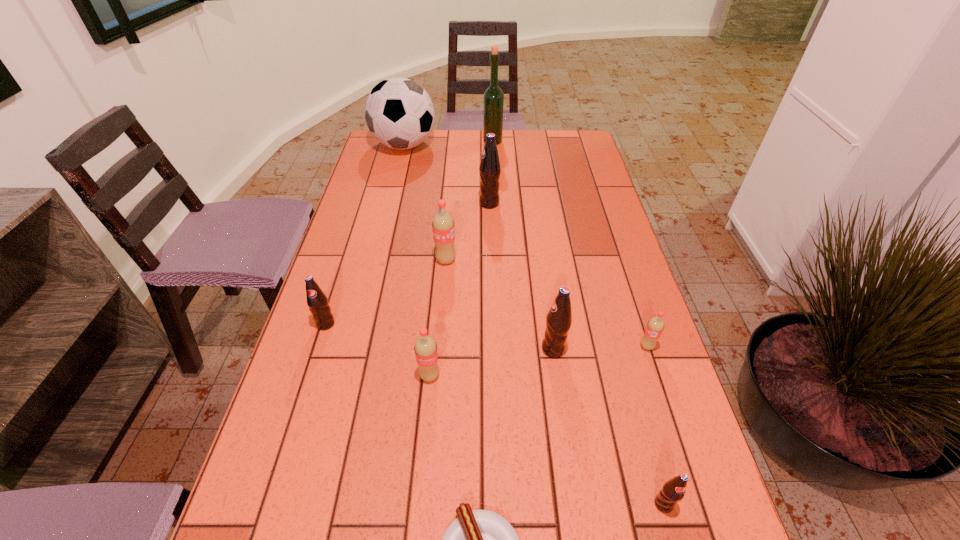
Find the location of `the second farthest black pop`. the second farthest black pop is located at coordinates (317, 301).

Locate an element on the screen. This screenshot has width=960, height=540. the nearest red soda is located at coordinates (426, 352).

Where is `the second nearest pop`? the second nearest pop is located at coordinates (426, 352).

You are a GUI agent. You are given a task and a screenshot of the screen. Output one action in this format:
    pyautogui.click(x=<x>, y=<y>)
    Task: Click on the rightmost object
    
    Given the screenshot: What is the action you would take?
    pyautogui.click(x=655, y=326)

Where is `the second farthest red soda`? This screenshot has height=540, width=960. the second farthest red soda is located at coordinates (655, 326).

At what (x,y) coordinates should I click in order to perform the action: click on the rightmost black pop. Please return your answer as a coordinate pair (x, y). This screenshot has width=960, height=540. Looking at the image, I should click on (673, 491).

At what (x,y) coordinates should I click in order to perform the action: click on the nearest black pop. Please return your answer as a coordinate pair (x, y). The height and width of the screenshot is (540, 960). Looking at the image, I should click on (673, 491).

This screenshot has height=540, width=960. Find the location of `free region located on the left of the liquor`. free region located on the left of the liquor is located at coordinates (402, 141).

Image resolution: width=960 pixels, height=540 pixels. Find the location of `vacant space located 0.360m on the main logo of the soccer ball`. vacant space located 0.360m on the main logo of the soccer ball is located at coordinates (533, 146).

I want to click on free region located on the front label of the third farthest object, so click(x=450, y=204).